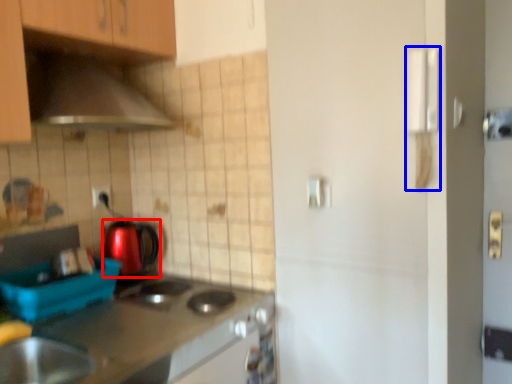
Question: Which object is closer to the camera taking this photo, kitchen appliance (highlighted by a red box) or door handle (highlighted by a blue box)?

Choices:
 (A) kitchen appliance
 (B) door handle

Answer: (B)